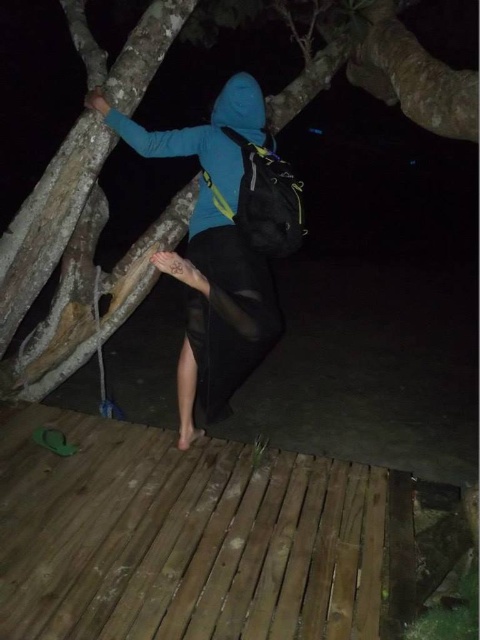
Question: Is blue matte jacket at upper center wider than blue fleece hoodie at upper center?

Choices:
 (A) no
 (B) yes

Answer: (B)

Question: Estimate the real-world distances between objects in this image. Which object is farther from the blue matte jacket at upper center?

Choices:
 (A) blue fleece hoodie at upper center
 (B) rough bark tree at upper center

Answer: (B)

Question: Which point appears closest to the camera in this image?

Choices:
 (A) (218, 182)
 (B) (224, 273)
 (C) (122, 269)

Answer: (A)

Question: Which point is closer to the camera?

Choices:
 (A) pos(244,113)
 (B) pos(218,346)
 (C) pos(71,316)

Answer: (A)

Question: Is rough bark tree at upper center further to the viewer compared to blue matte jacket at upper center?

Choices:
 (A) yes
 (B) no

Answer: (A)

Question: Where is rough bark tree at upper center located in relation to blue matte jacket at upper center in the image?

Choices:
 (A) right
 (B) left

Answer: (B)